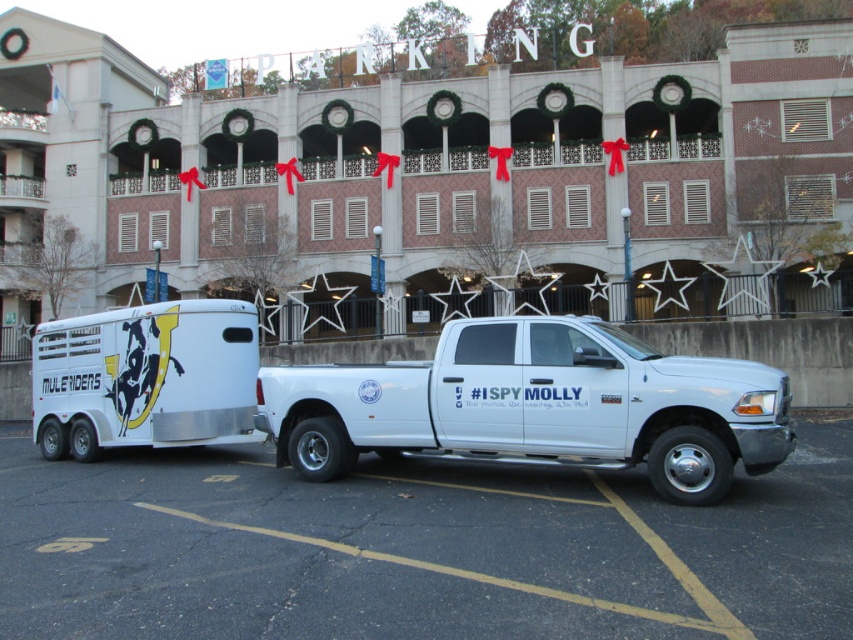
Question: Is white smooth asphalt at lower center behind metallic silver horse trailer at center?

Choices:
 (A) no
 (B) yes

Answer: (A)

Question: Which point is farther to the camera?

Choices:
 (A) white smooth asphalt at lower center
 (B) white matte truck at center
 (C) metallic silver horse trailer at center

Answer: (C)

Question: Can you confirm if white matte truck at center is positioned above metallic silver horse trailer at center?

Choices:
 (A) no
 (B) yes

Answer: (B)

Question: Can you confirm if white smooth asphalt at lower center is wider than white matte truck at center?

Choices:
 (A) no
 (B) yes

Answer: (B)

Question: Which point is farther from the camera taking this photo?

Choices:
 (A) (103, 579)
 (B) (253, 381)
 (C) (695, 362)

Answer: (B)

Question: Among these points, which one is farthest from the camera?

Choices:
 (A) (824, 538)
 (B) (656, 388)
 (C) (194, 358)

Answer: (C)